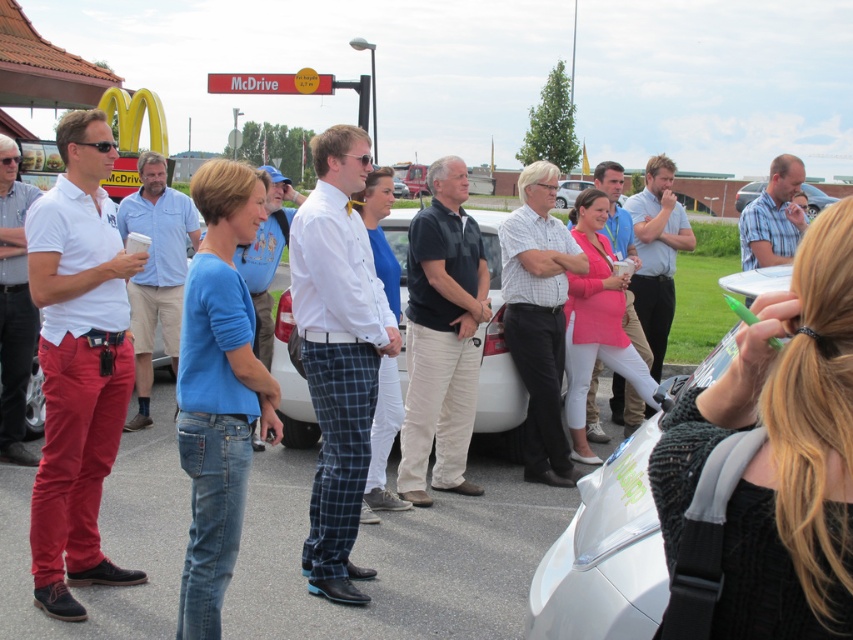
You are standing at the McDonalds McDrive service area in the image. You see a point marked at coordinates (605,554). What object is located at that point?

The point at coordinates (605,554) corresponds to the white glossy car at center.